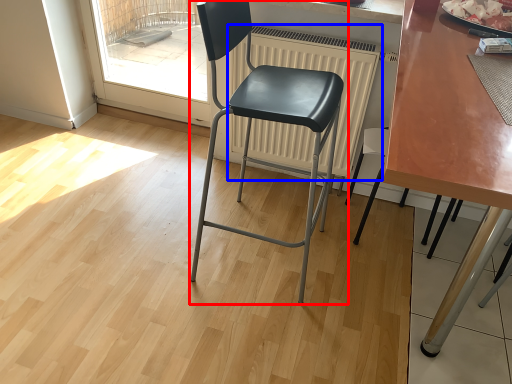
Question: Among these objects, which one is farthest to the camera, chair (highlighted by a red box) or radiator (highlighted by a blue box)?

Choices:
 (A) chair
 (B) radiator

Answer: (B)